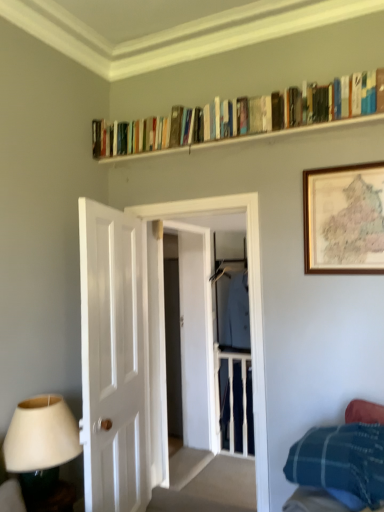
Question: Considering the relative sizes of white glossy door at left and wooden bookshelf at upper center in the image provided, is white glossy door at left thinner than wooden bookshelf at upper center?

Choices:
 (A) no
 (B) yes

Answer: (A)

Question: Is white glossy door at left bigger than wooden bookshelf at upper center?

Choices:
 (A) yes
 (B) no

Answer: (A)

Question: From a real-world perspective, is white glossy door at left under wooden bookshelf at upper center?

Choices:
 (A) no
 (B) yes

Answer: (B)

Question: Is white glossy door at left aimed at wooden bookshelf at upper center?

Choices:
 (A) yes
 (B) no

Answer: (B)

Question: Is white glossy door at left positioned before wooden bookshelf at upper center?

Choices:
 (A) no
 (B) yes

Answer: (B)

Question: From the image's perspective, is white glossy door at left over wooden bookshelf at upper center?

Choices:
 (A) yes
 (B) no

Answer: (B)

Question: Is blue plaid blanket at lower right facing towards white glossy door at left?

Choices:
 (A) no
 (B) yes

Answer: (A)

Question: From a real-world perspective, does blue plaid blanket at lower right stand above white glossy door at left?

Choices:
 (A) yes
 (B) no

Answer: (B)

Question: Does blue plaid blanket at lower right appear on the left side of white glossy door at left?

Choices:
 (A) no
 (B) yes

Answer: (A)

Question: Is blue plaid blanket at lower right closer to camera compared to white glossy door at left?

Choices:
 (A) yes
 (B) no

Answer: (A)

Question: Does blue plaid blanket at lower right have a smaller size compared to white glossy door at left?

Choices:
 (A) yes
 (B) no

Answer: (A)

Question: From the image's perspective, is blue plaid blanket at lower right below white glossy door at left?

Choices:
 (A) no
 (B) yes

Answer: (B)

Question: Is light blue fabric coat at center positioned in front of white glossy door at left?

Choices:
 (A) no
 (B) yes

Answer: (A)